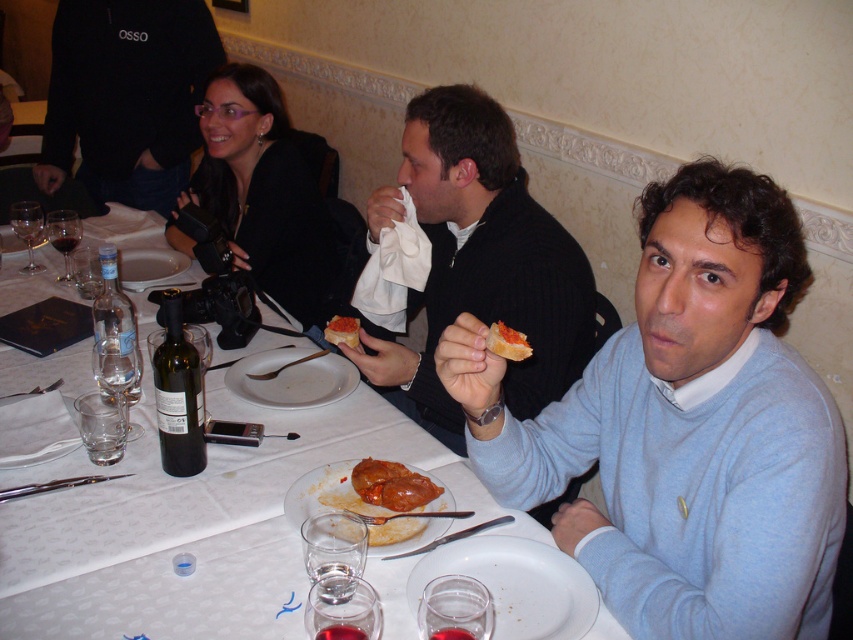
Question: Which is nearer to the smooth tomato paste spread at center?

Choices:
 (A) red glossy meat at center
 (B) light blue sweater at center

Answer: (B)

Question: Which point is farther to the camera?

Choices:
 (A) white paper plate at center
 (B) smooth tomato paste at center
 (C) light blue sweater at center
 (D) red glossy meat at center

Answer: (B)

Question: Does white paper plate at center come behind meat with tomato sauce at center?

Choices:
 (A) no
 (B) yes

Answer: (A)

Question: Is white paper plate at center to the left of matte black camera at upper left from the viewer's perspective?

Choices:
 (A) yes
 (B) no

Answer: (B)

Question: Which point is closer to the camera?

Choices:
 (A) (432, 308)
 (B) (328, 323)
 (C) (524, 356)
 (D) (438, 502)

Answer: (C)

Question: Does red glossy meat at center appear over smooth tomato paste at center?

Choices:
 (A) yes
 (B) no

Answer: (B)